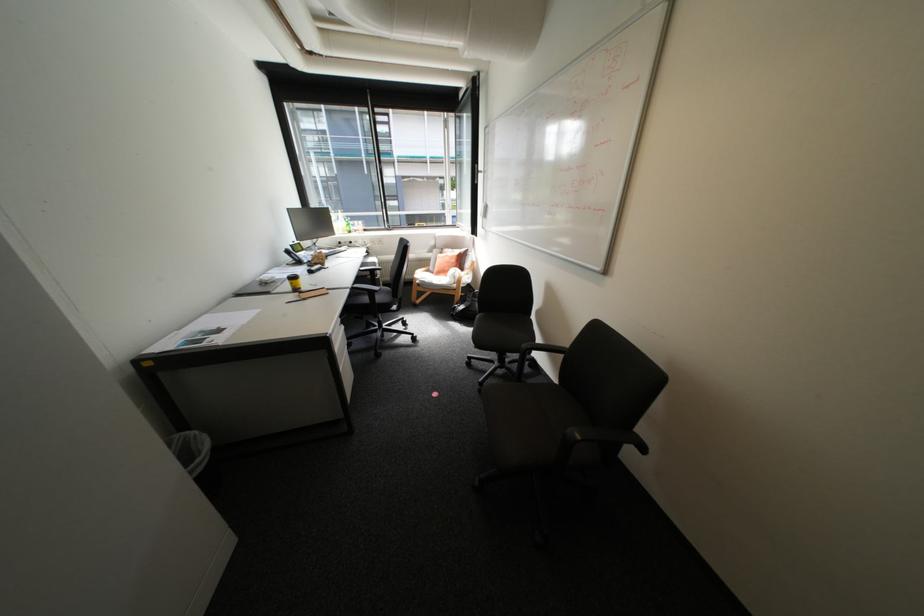
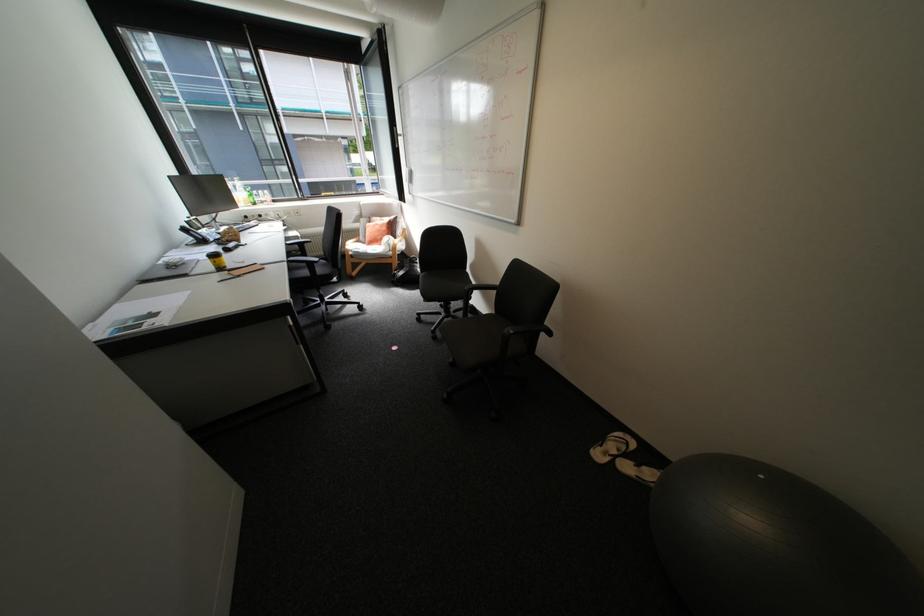
Locate, in the second image, the point that corresponds to (x=296, y=286) in the first image.

(217, 265)